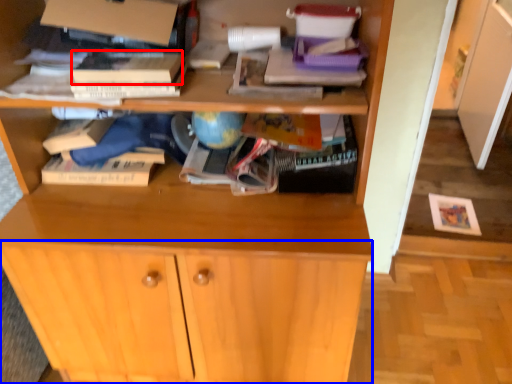
Question: Among these objects, which one is nearest to the camera, paperback book (highlighted by a red box) or cabinetry (highlighted by a blue box)?

Choices:
 (A) paperback book
 (B) cabinetry

Answer: (A)